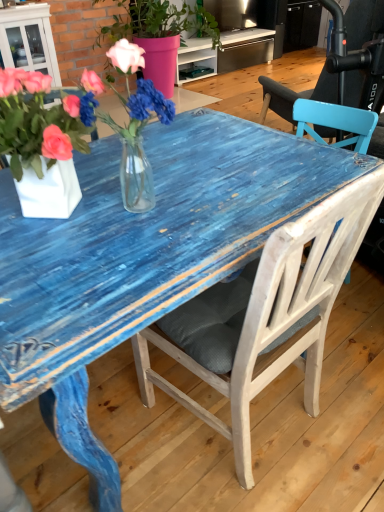
Question: Is white wood chair at center aimed at translucent glass vase at center?

Choices:
 (A) yes
 (B) no

Answer: (B)

Question: Does white wood chair at center appear on the right side of translucent glass vase at center?

Choices:
 (A) no
 (B) yes

Answer: (B)

Question: Is white wood chair at center not near translucent glass vase at center?

Choices:
 (A) yes
 (B) no

Answer: (B)

Question: Is white wood chair at center positioned beyond the bounds of translucent glass vase at center?

Choices:
 (A) no
 (B) yes

Answer: (B)

Question: Is white wood chair at center behind translucent glass vase at center?

Choices:
 (A) no
 (B) yes

Answer: (A)

Question: From their relative heights in the image, would you say white wood chair at center is taller or shorter than pink matte vase at upper center, the first houseplant in the top-to-bottom sequence?

Choices:
 (A) short
 (B) tall

Answer: (A)

Question: Considering the relative positions of white wood chair at center and pink matte vase at upper center, which is the first houseplant in back-to-front order, in the image provided, is white wood chair at center to the left or to the right of pink matte vase at upper center, which is the first houseplant in back-to-front order,?

Choices:
 (A) left
 (B) right

Answer: (B)

Question: From the image's perspective, relative to pink matte vase at upper center, the first houseplant in the top-to-bottom sequence, is white wood chair at center above or below?

Choices:
 (A) below
 (B) above

Answer: (A)

Question: Considering the positions of white wood chair at center and pink matte vase at upper center, which is the first houseplant in back-to-front order, in the image, is white wood chair at center bigger or smaller than pink matte vase at upper center, which is the first houseplant in back-to-front order,?

Choices:
 (A) big
 (B) small

Answer: (B)

Question: Based on their positions, is white matte vase at left, which is the 2th houseplant from back to front, located to the left or right of translucent glass vase at center?

Choices:
 (A) right
 (B) left

Answer: (B)

Question: Is white matte vase at left, the 2th houseplant in the top-to-bottom sequence, situated inside translucent glass vase at center or outside?

Choices:
 (A) outside
 (B) inside

Answer: (A)

Question: From their relative heights in the image, would you say white matte vase at left, which is the 2th houseplant from back to front, is taller or shorter than translucent glass vase at center?

Choices:
 (A) short
 (B) tall

Answer: (A)

Question: Is point (69, 155) closer or farther from the camera than point (117, 67)?

Choices:
 (A) closer
 (B) farther

Answer: (A)

Question: From the image's perspective, relative to white wood chair at center, is translucent glass vase at center above or below?

Choices:
 (A) above
 (B) below

Answer: (A)

Question: Is translucent glass vase at center wider or thinner than white wood chair at center?

Choices:
 (A) wide
 (B) thin

Answer: (B)